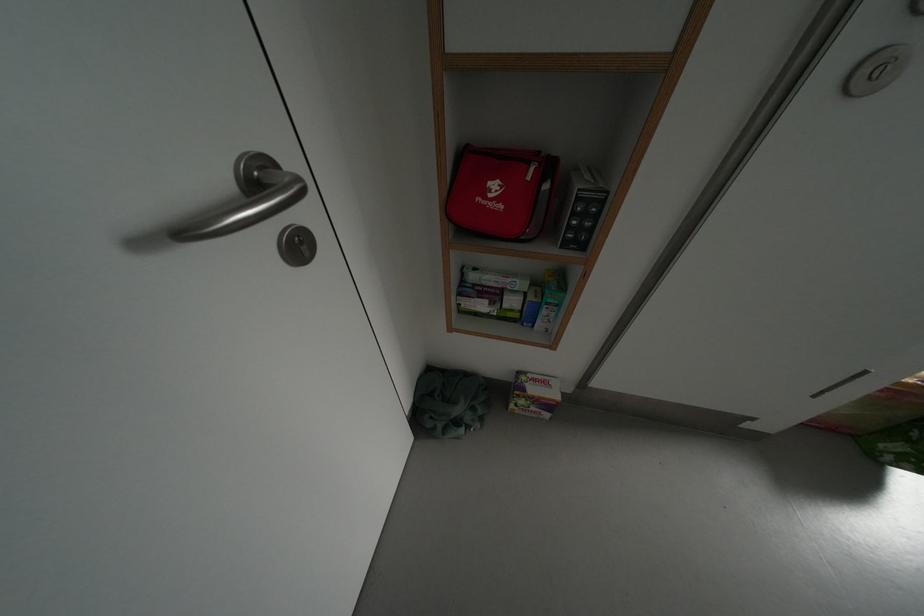
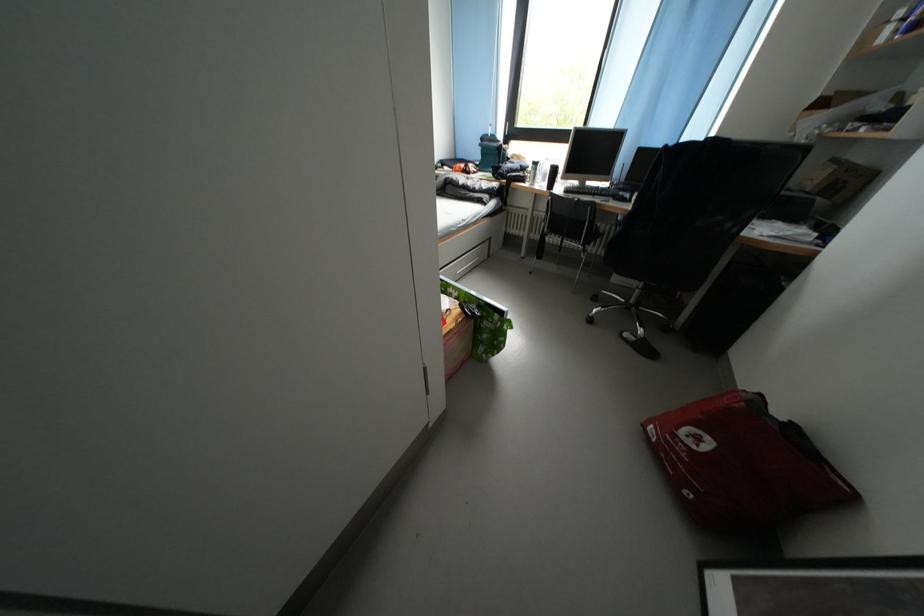
Question: The images are taken continuously from a first-person perspective. In which direction is your viewpoint rotating?

Choices:
 (A) Left
 (B) Right
 (C) Up
 (D) Down

Answer: (B)